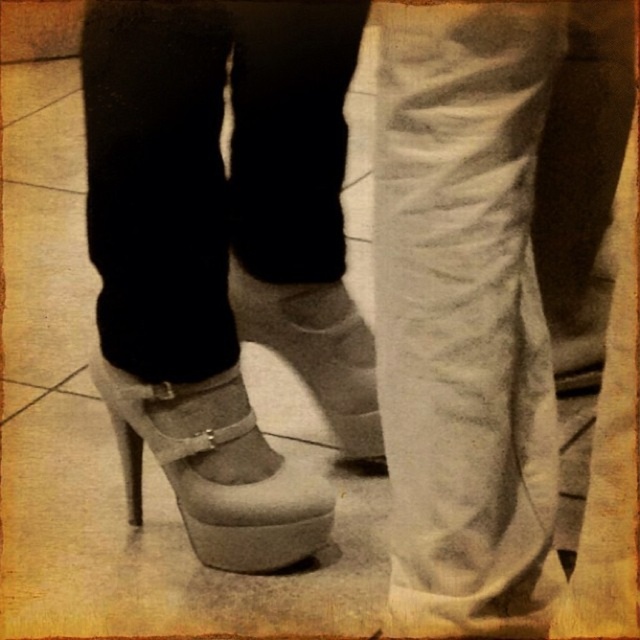
You are a photographer setting up a shoot in a vintage hallway. You need to place a small prop between the matte gray sandal at center and the white suede shoe at center. Given their positions, which shoe should the prop be closer to if you want it to be nearer to the shorter one?

The matte gray sandal at center is shorter than the white suede shoe at center, so the prop should be placed closer to the matte gray sandal at center to be nearer to the shorter one.

You are a photographer trying to capture the matte gray sandal at center and the white suede shoe at center in a clear shot. Since both are at the center, which one is blocking the view of the other?

The matte gray sandal at center is positioned under the white suede shoe at center, so the white suede shoe at center is blocking the view of the matte gray sandal at center.

You are a shoe salesperson and need to determine which shoe to recommend to a customer who prefers larger footwear. Looking at the image, which one between the matte gray sandal at center and the white suede shoe at center should you suggest?

The matte gray sandal at center has a larger size compared to the white suede shoe at center, so you should recommend the matte gray sandal at center.